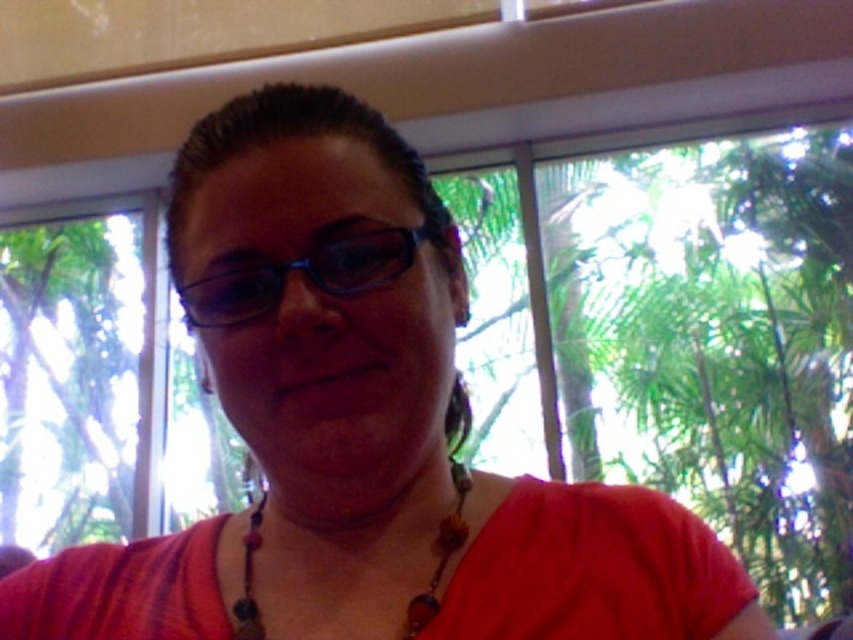
Looking at this image, does transparent plastic glasses at center appear under beaded necklace at center?

Incorrect, transparent plastic glasses at center is not positioned below beaded necklace at center.

Is transparent plastic glasses at center to the right of beaded necklace at center from the viewer's perspective?

No, transparent plastic glasses at center is not to the right of beaded necklace at center.

You are a GUI agent. You are given a task and a screenshot of the screen. Output one action in this format:
    pyautogui.click(x=<x>, y=<y>)
    Task: Click on the transparent plastic glasses at center
    
    Given the screenshot: What is the action you would take?
    pyautogui.click(x=308, y=275)